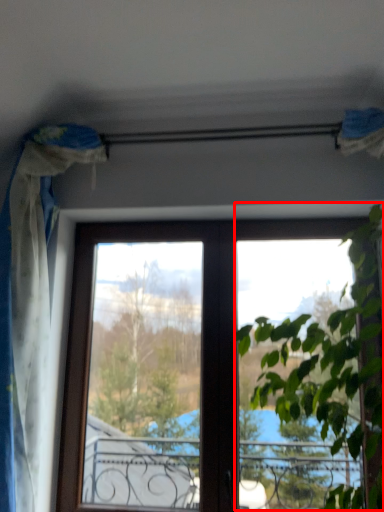
Question: From the image's perspective, what is the correct spatial relationship of vegetation (annotated by the red box) in relation to curtain?

Choices:
 (A) below
 (B) above

Answer: (A)